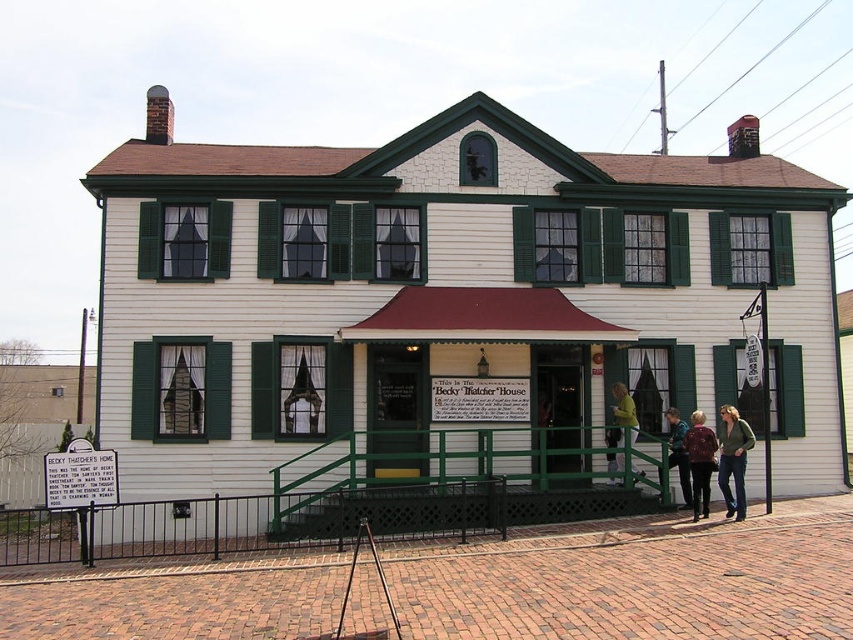
You are a delivery person trying to place a large package on the yellow fabric at center. However, there is a dark brown leather jacket at lower right nearby. Considering their sizes, which item can you move to make space for the package?

The dark brown leather jacket at lower right has a larger size compared to the yellow fabric at center, so you should move the dark brown leather jacket at lower right to make space for the package.